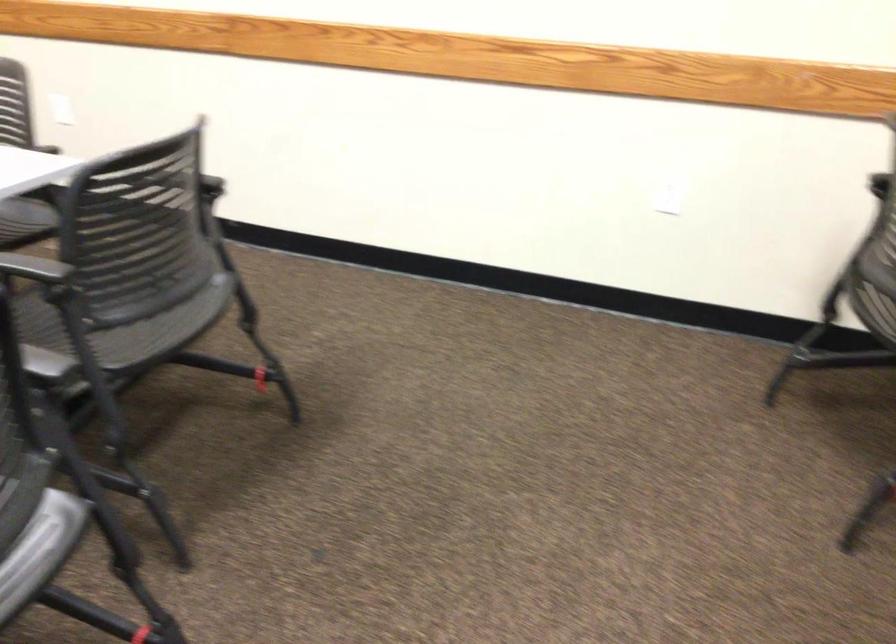
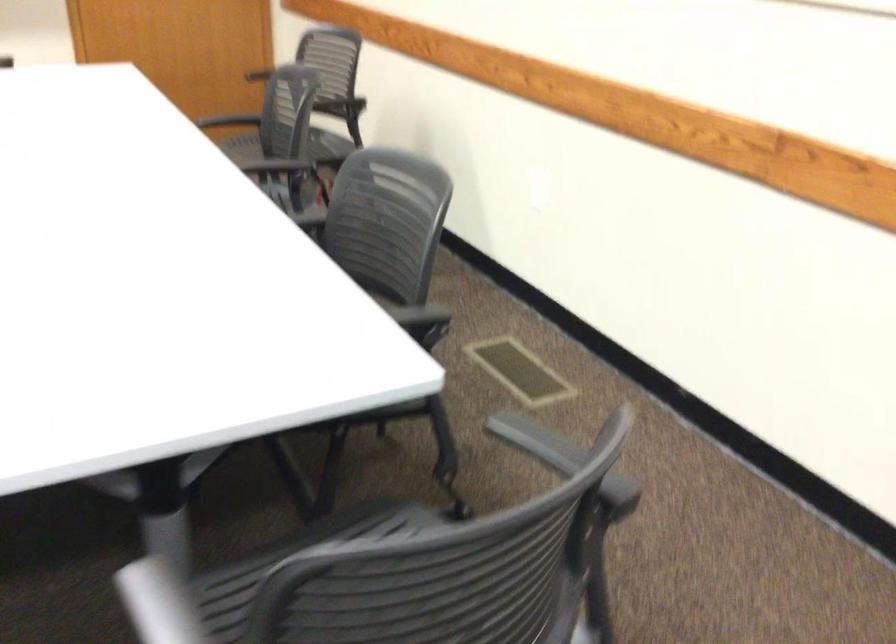
Locate, in the second image, the point that corresponds to pixel 91 172 in the first image.

(293, 560)